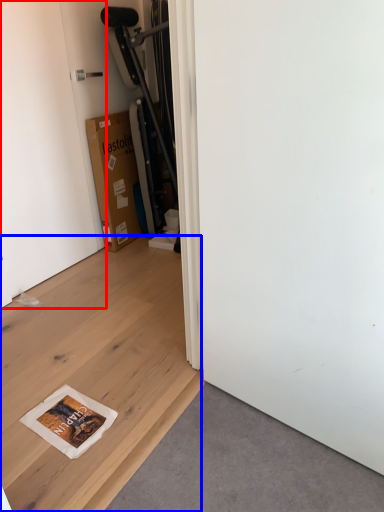
Question: Which of the following is the farthest to the observer, door (highlighted by a red box) or plywood (highlighted by a blue box)?

Choices:
 (A) door
 (B) plywood

Answer: (A)